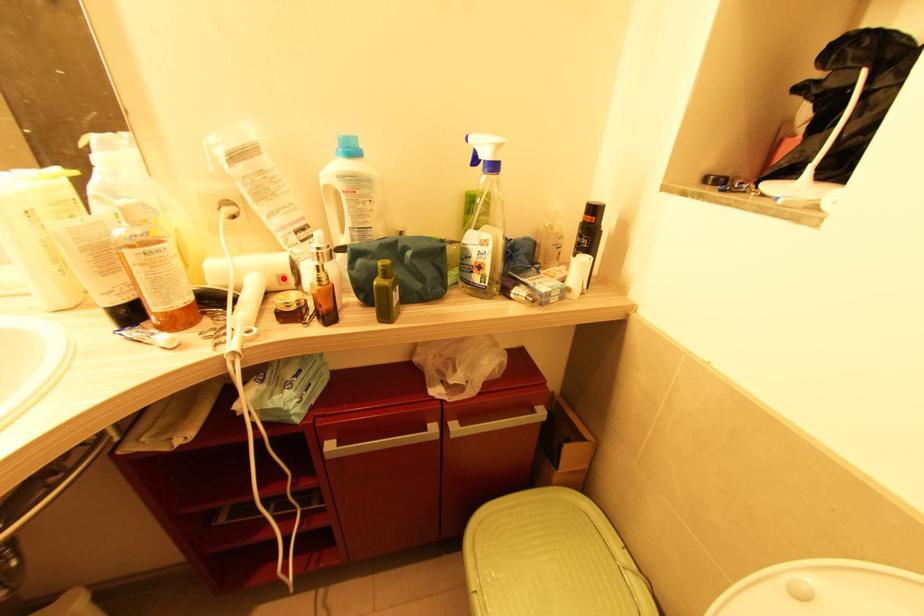
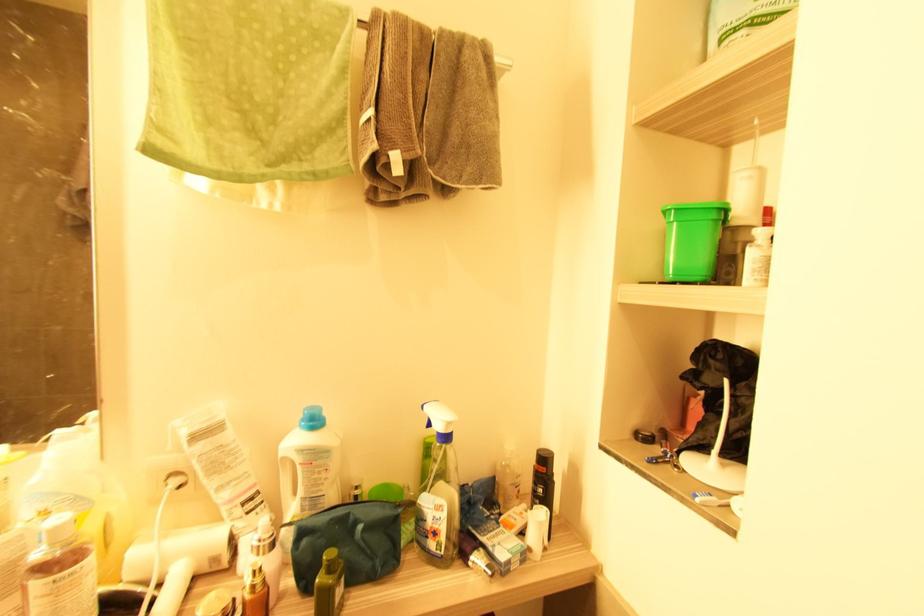
In the second image, find the point that corresponds to the highlighted location in the first image.

(216, 561)